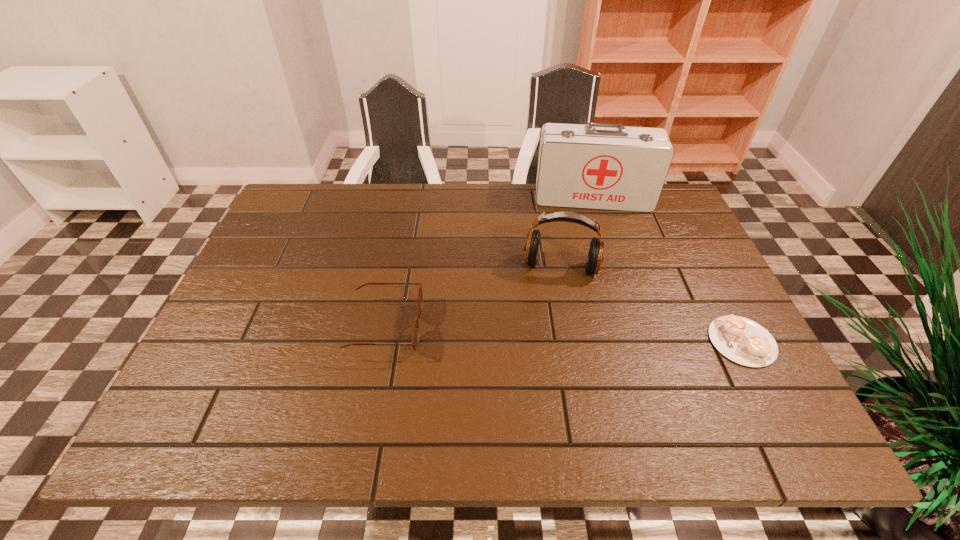
Locate an element on the screen. This screenshot has height=540, width=960. object located at the far right corner is located at coordinates (606, 166).

In order to click on object present at the near right corner in this screenshot , I will do `click(741, 340)`.

At what (x,y) coordinates should I click in order to perform the action: click on vacant space at the far edge. Please return your answer as a coordinate pair (x, y). Looking at the image, I should click on (444, 228).

In order to click on free spot at the right edge of the desktop in this screenshot , I will do `click(688, 264)`.

The image size is (960, 540). I want to click on vacant region at the far left corner of the desktop, so click(325, 218).

I want to click on free space at the far right corner of the desktop, so click(643, 221).

Locate an element on the screen. Image resolution: width=960 pixels, height=540 pixels. free spot at the near right corner of the desktop is located at coordinates 716,369.

The image size is (960, 540). Find the location of `free space between the third shortest object and the spectacles`. free space between the third shortest object and the spectacles is located at coordinates (473, 298).

Locate an element on the screen. free space between the first-aid kit and the headset is located at coordinates (577, 233).

Image resolution: width=960 pixels, height=540 pixels. Identify the location of free space between the farthest object and the headset. (577, 233).